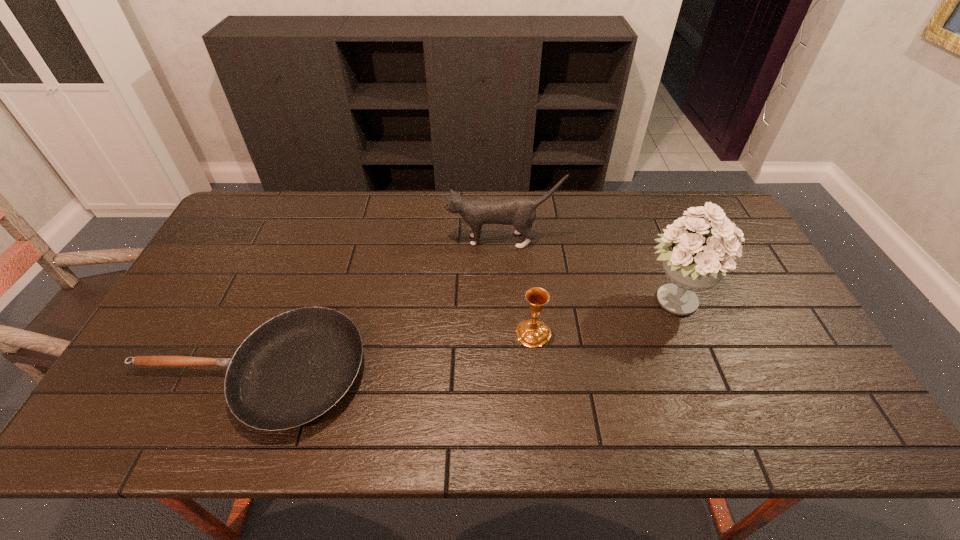
Find the location of a particular element. Image resolution: width=960 pixels, height=540 pixels. free location located 0.260m at the face of the farthest object is located at coordinates (367, 240).

This screenshot has width=960, height=540. What are the coordinates of `free region located 0.160m on the back of the chalice` in the screenshot? It's located at (528, 277).

Locate an element on the screen. Image resolution: width=960 pixels, height=540 pixels. vacant region located 0.060m on the back of the frying pan is located at coordinates (278, 302).

The height and width of the screenshot is (540, 960). Find the location of `object located in the far edge section of the desktop`. object located in the far edge section of the desktop is located at coordinates (521, 212).

Locate an element on the screen. object situated at the near edge is located at coordinates (294, 368).

Locate an element on the screen. Image resolution: width=960 pixels, height=540 pixels. object present at the left edge is located at coordinates (294, 368).

Locate an element on the screen. This screenshot has width=960, height=540. object at the near left corner is located at coordinates (294, 368).

Image resolution: width=960 pixels, height=540 pixels. Find the location of `free point at the far edge`. free point at the far edge is located at coordinates (605, 193).

Image resolution: width=960 pixels, height=540 pixels. In order to click on free space at the near edge in this screenshot , I will do `click(732, 441)`.

I want to click on vacant space at the left edge, so [192, 281].